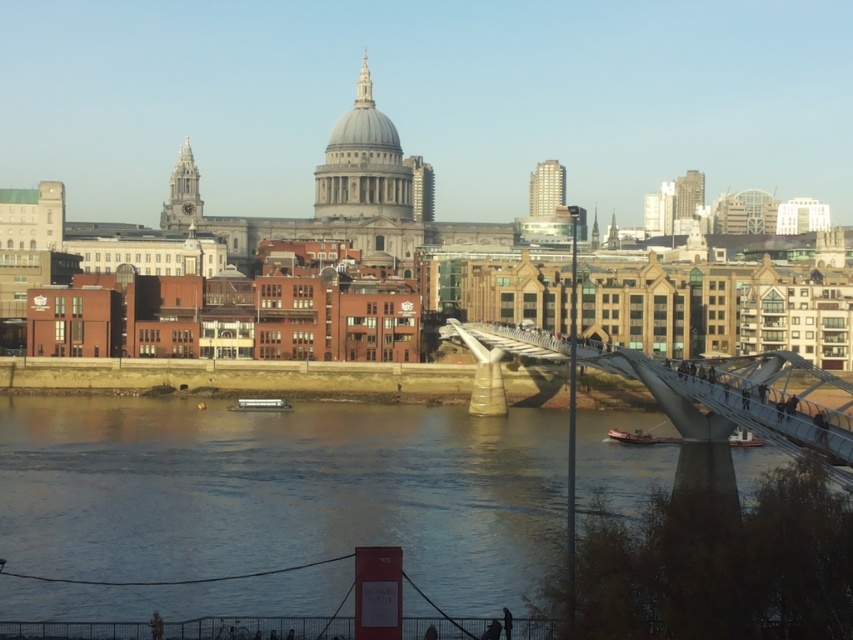
Question: Which point is farther from the camera taking this photo?

Choices:
 (A) (780, 442)
 (B) (152, 460)

Answer: (B)

Question: Does clear water at lower center have a larger size compared to metallic gray bridge at center?

Choices:
 (A) no
 (B) yes

Answer: (B)

Question: Is clear water at lower center smaller than metallic gray bridge at center?

Choices:
 (A) no
 (B) yes

Answer: (A)

Question: Does clear water at lower center appear over metallic gray bridge at center?

Choices:
 (A) yes
 (B) no

Answer: (B)